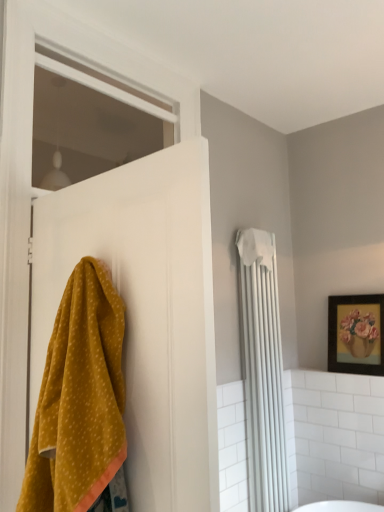
Question: Looking at their shapes, would you say yellow fabric at left is wider or thinner than wooden framed painting at upper right?

Choices:
 (A) wide
 (B) thin

Answer: (A)

Question: From the image's perspective, is yellow fabric at left above or below wooden framed painting at upper right?

Choices:
 (A) above
 (B) below

Answer: (A)

Question: Estimate the real-world distances between objects in this image. Which object is farther from the yellow fabric at left?

Choices:
 (A) mustard yellow towel at left
 (B) wooden framed painting at upper right
 (C) white fabric towel at upper right
 (D) white matte window at upper left

Answer: (D)

Question: Estimate the real-world distances between objects in this image. Which object is closer to the mustard yellow towel at left?

Choices:
 (A) wooden framed painting at upper right
 (B) white matte window at upper left
 (C) yellow fabric at left
 (D) white fabric towel at upper right

Answer: (C)